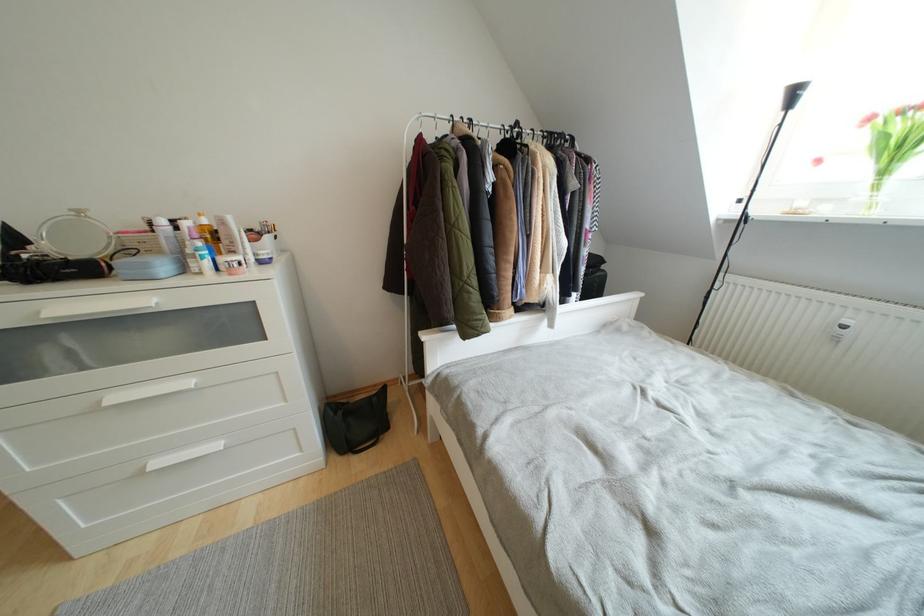
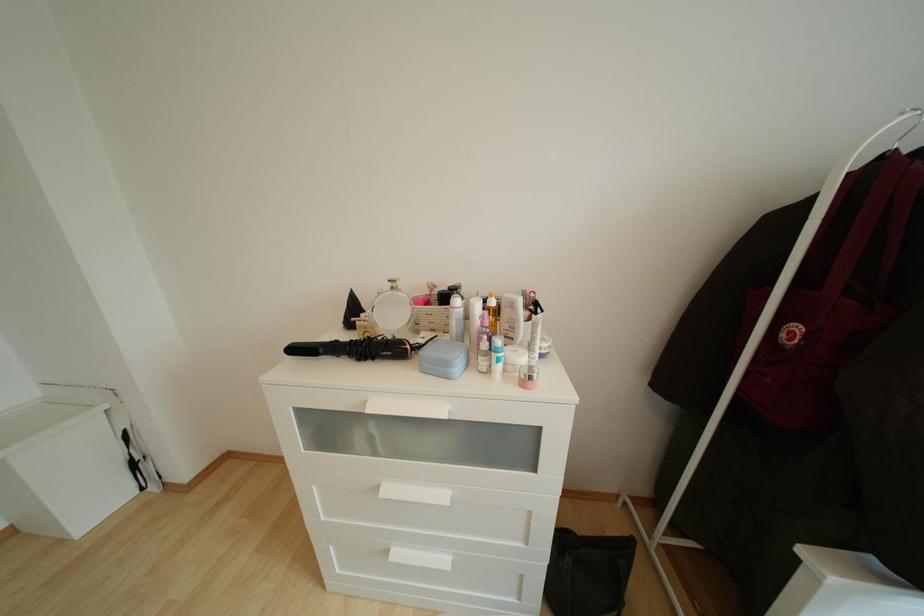
Question: Based on the continuous images, in which direction is the camera rotating? Reply with the corresponding letter.

Choices:
 (A) Left
 (B) Right
 (C) Up
 (D) Down

Answer: (A)